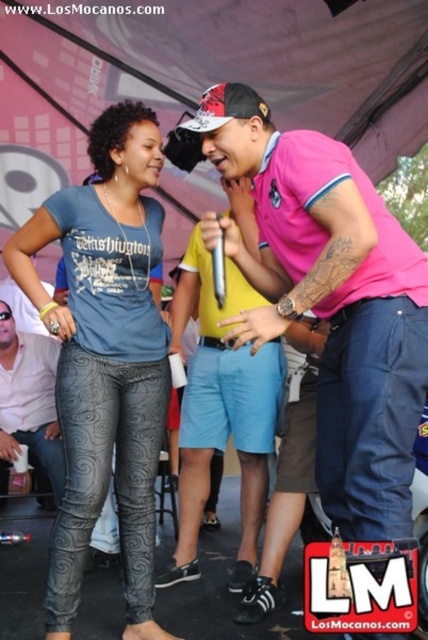
You are a photographer at the event and want to take a group photo of the matte yellow shirt at center and the white matte shirt at center. The camera you have can capture a maximum distance of 1.5 meters between subjects for clear focus. Will both shirts be in focus in the photo?

The matte yellow shirt at center and white matte shirt at center are 1.33 meters apart, which is within the camera maximum distance of 1.5 meters. Both shirts will be in focus.

You are a photographer at the event and want to capture both the pink cotton shirt at center and the white matte shirt at center in your photo. Since the tent is crowded, you need to adjust your position to ensure both are visible. Based on their positions, which shirt should you focus on first to frame both properly?

The pink cotton shirt at center is in front of the white matte shirt at center, so you should focus on positioning the camera to ensure the white matte shirt at center is visible behind the pink cotton shirt at center.